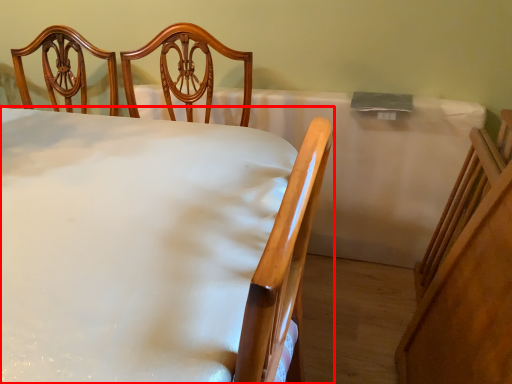
Question: Observing the image, what is the correct spatial positioning of furniture (annotated by the red box) in reference to tablecloth?

Choices:
 (A) left
 (B) right

Answer: (A)